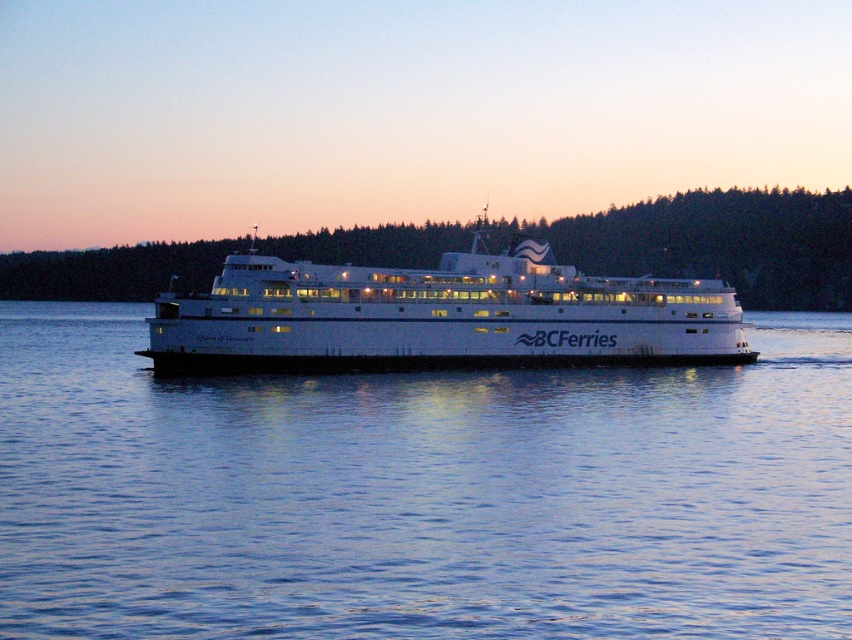
Is blue water at center wider than white smooth ferry at center?

Yes, blue water at center is wider than white smooth ferry at center.

Which of these two, blue water at center or white smooth ferry at center, stands shorter?

With less height is blue water at center.

What do you see at coordinates (421, 493) in the screenshot?
I see `blue water at center` at bounding box center [421, 493].

I want to click on blue water at center, so click(421, 493).